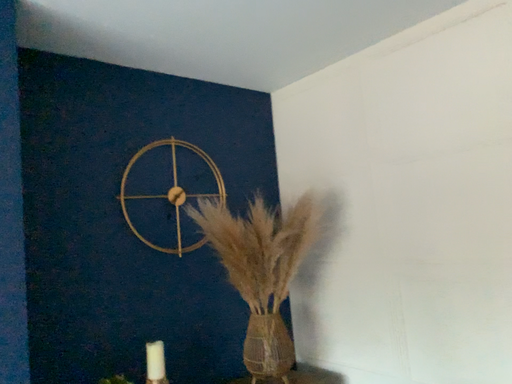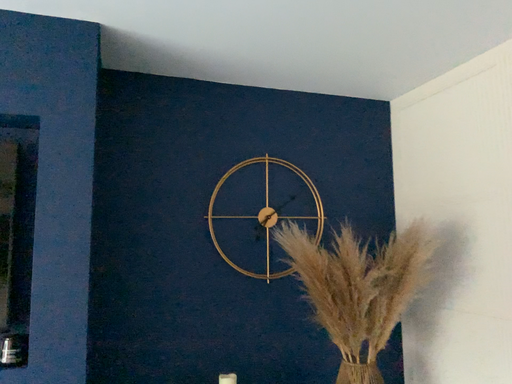
Question: How did the camera likely rotate when shooting the video?

Choices:
 (A) rotated right
 (B) rotated left

Answer: (B)